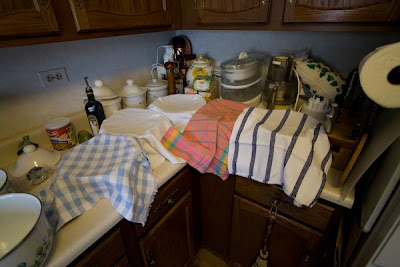
Identify the location of upper cabinets. This screenshot has height=267, width=400. (47, 21), (107, 23), (236, 12), (329, 15).